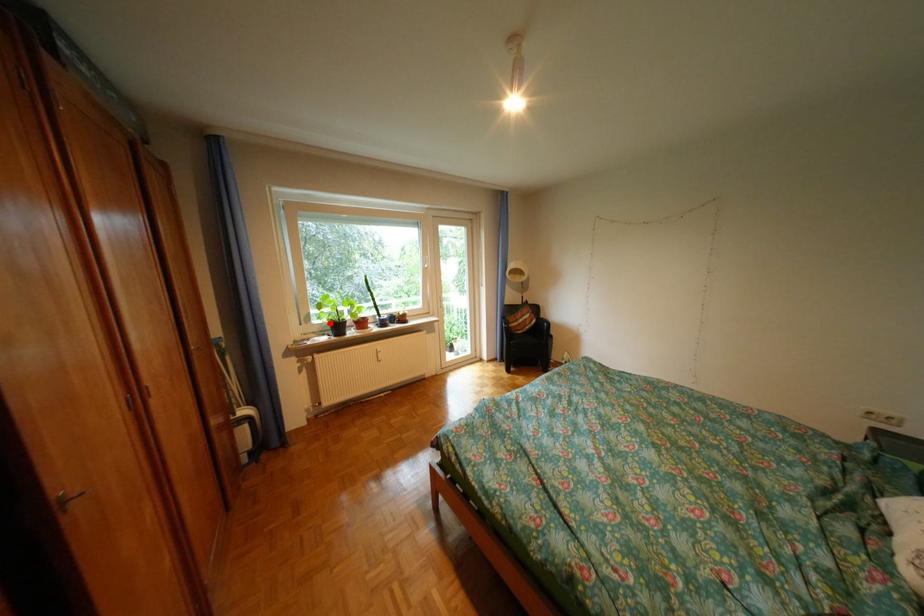
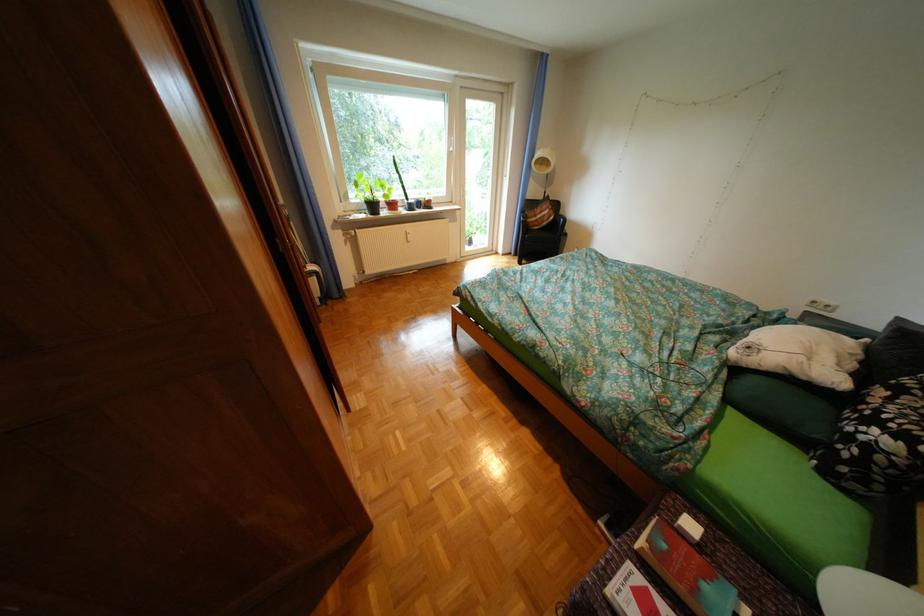
In the second image, find the point that corresponds to the highlighted location in the first image.

(368, 201)